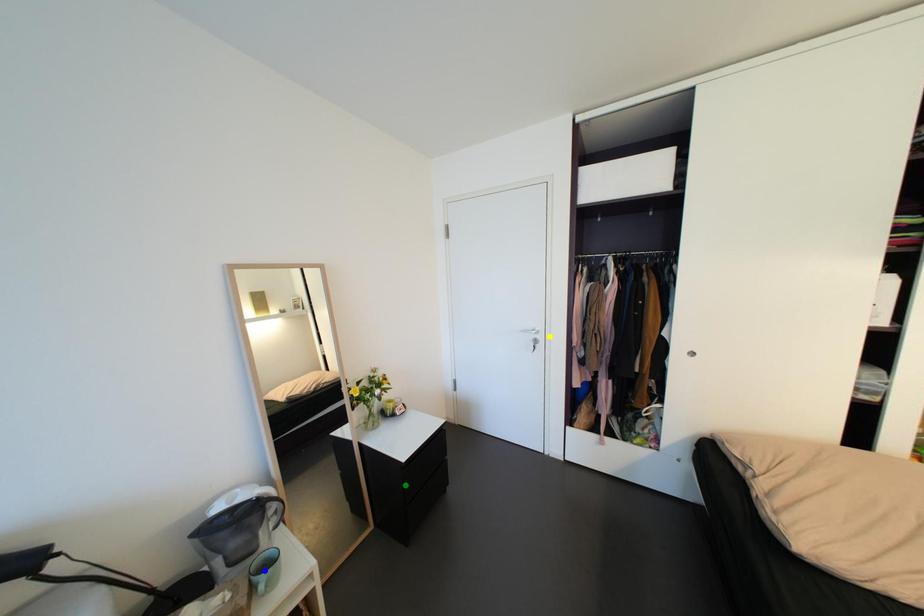
Order these from nearest to farthest:
A) blue point
B) green point
C) yellow point

blue point → green point → yellow point